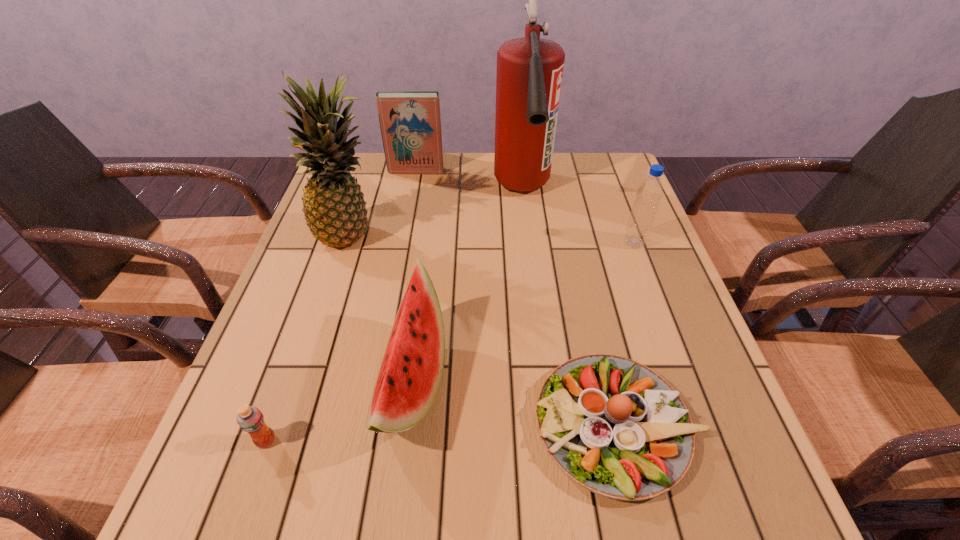
Find the location of a particular element. free space in the image that satisfies the following two spatial constraints: 1. on the back side of the orange juice; 2. on the right side of the shortest object is located at coordinates (272, 424).

The height and width of the screenshot is (540, 960). I want to click on free space that satisfies the following two spatial constraints: 1. at the nozzle of the tallest object; 2. on the outer rind of the fifth tallest object, so click(544, 382).